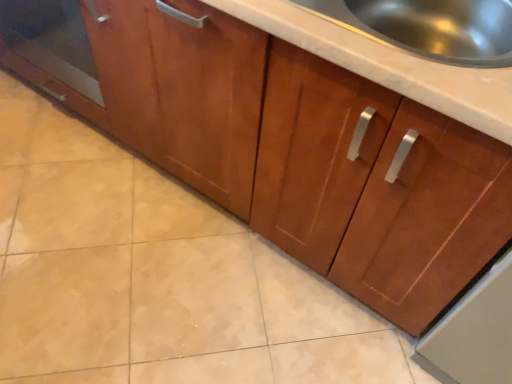
Describe the element at coordinates (52, 41) in the screenshot. I see `transparent glass door at left` at that location.

At what (x,y) coordinates should I click in order to perform the action: click on transparent glass door at left. Please return your answer as a coordinate pair (x, y). The height and width of the screenshot is (384, 512). Looking at the image, I should click on pyautogui.click(x=52, y=41).

This screenshot has width=512, height=384. Identify the location of stainless steel sink at upper right. [x=430, y=27].

What is the approximate height of stainless steel sink at upper right?

stainless steel sink at upper right is 5.81 inches in height.

Image resolution: width=512 pixels, height=384 pixels. Describe the element at coordinates (430, 27) in the screenshot. I see `stainless steel sink at upper right` at that location.

Locate an element on the screen. transparent glass door at left is located at coordinates (52, 41).

In the image, is transparent glass door at left on the left side or the right side of stainless steel sink at upper right?

In the image, transparent glass door at left appears on the left side of stainless steel sink at upper right.

Relative to stainless steel sink at upper right, is transparent glass door at left in front or behind?

In the image, transparent glass door at left appears behind stainless steel sink at upper right.

Which is behind, point (8, 37) or point (422, 52)?

The point (8, 37) is farther.

From the image's perspective, is transparent glass door at left on stainless steel sink at upper right?

Yes, from the image's perspective, transparent glass door at left is on top of stainless steel sink at upper right.

From a real-world perspective, is transparent glass door at left located higher than stainless steel sink at upper right?

Actually, transparent glass door at left is physically below stainless steel sink at upper right in the real world.

In terms of width, does transparent glass door at left look wider or thinner when compared to stainless steel sink at upper right?

transparent glass door at left is wider than stainless steel sink at upper right.

Is transparent glass door at left taller than stainless steel sink at upper right?

Correct, transparent glass door at left is much taller as stainless steel sink at upper right.

Is transparent glass door at left bigger than stainless steel sink at upper right?

Indeed, transparent glass door at left has a larger size compared to stainless steel sink at upper right.

Is transparent glass door at left spatially inside stainless steel sink at upper right, or outside of it?

transparent glass door at left is located beyond the bounds of stainless steel sink at upper right.

Is transparent glass door at left positioned far away from stainless steel sink at upper right?

Indeed, transparent glass door at left is not near stainless steel sink at upper right.

Is transparent glass door at left oriented towards stainless steel sink at upper right?

No.

Find the location of a particular element. The image size is (512, 384). glass door that is on the left side of stainless steel sink at upper right is located at coordinates (52, 41).

Based on the photo, which object is positioned more to the right, stainless steel sink at upper right or transparent glass door at left?

Positioned to the right is stainless steel sink at upper right.

Which object is closer to the camera, stainless steel sink at upper right or transparent glass door at left?

Positioned in front is stainless steel sink at upper right.

Does point (479, 17) come farther from viewer compared to point (88, 45)?

No, (479, 17) is in front of (88, 45).

From the image's perspective, is stainless steel sink at upper right below transparent glass door at left?

Yes, from the image's perspective, stainless steel sink at upper right is beneath transparent glass door at left.

From a real-world perspective, which is physically below, stainless steel sink at upper right or transparent glass door at left?

From a 3D spatial view, transparent glass door at left is below.

Does stainless steel sink at upper right have a lesser width compared to transparent glass door at left?

Yes.

From their relative heights in the image, would you say stainless steel sink at upper right is taller or shorter than transparent glass door at left?

Considering their sizes, stainless steel sink at upper right has less height than transparent glass door at left.

Which of these two, stainless steel sink at upper right or transparent glass door at left, is bigger?

Bigger between the two is transparent glass door at left.

Is stainless steel sink at upper right located outside transparent glass door at left?

Absolutely, stainless steel sink at upper right is external to transparent glass door at left.

Is stainless steel sink at upper right next to transparent glass door at left?

They are not placed beside each other.

Is stainless steel sink at upper right facing away from transparent glass door at left?

No, transparent glass door at left is not at the back of stainless steel sink at upper right.

How different are the orientations of stainless steel sink at upper right and transparent glass door at left in degrees?

There is a 0.647-degree angle between the facing directions of stainless steel sink at upper right and transparent glass door at left.

How far apart are stainless steel sink at upper right and transparent glass door at left?

stainless steel sink at upper right and transparent glass door at left are 1.10 meters apart.

This screenshot has width=512, height=384. In the image, there is a stainless steel sink at upper right. In order to click on glass door below it (from a real-world perspective) in this screenshot , I will do `click(52, 41)`.

Where is `glass door behind the stainless steel sink at upper right`? glass door behind the stainless steel sink at upper right is located at coordinates (52, 41).

Find the location of a particular element. glass door below the stainless steel sink at upper right (from a real-world perspective) is located at coordinates (52, 41).